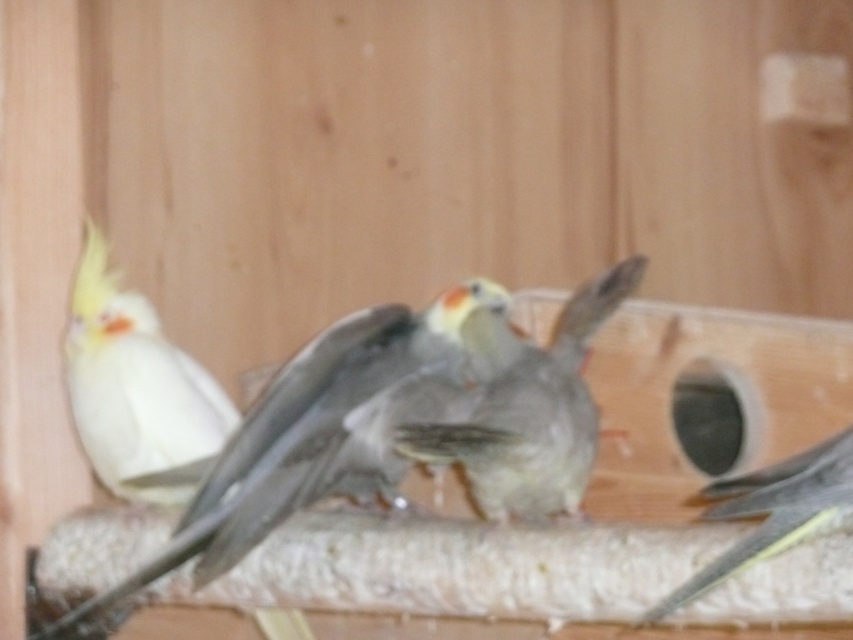
Question: Is white feathered bird at center further to camera compared to gray feathered bird at center?

Choices:
 (A) no
 (B) yes

Answer: (B)

Question: Which object is closer to the camera taking this photo?

Choices:
 (A) gray feathered bird at center
 (B) white feathered parrot at left

Answer: (A)

Question: Can you confirm if white feathered bird at center is positioned above gray feathered bird at center?

Choices:
 (A) no
 (B) yes

Answer: (B)

Question: Is white feathered parrot at left thinner than gray feathered bird at center?

Choices:
 (A) yes
 (B) no

Answer: (B)

Question: Which object is farther from the camera taking this photo?

Choices:
 (A) white feathered bird at center
 (B) gray matte bird at center
 (C) gray feathered bird at center
 (D) white feathered parrot at left

Answer: (D)

Question: Which point appears farthest from the camera in this image?

Choices:
 (A) (660, 618)
 (B) (469, 356)
 (C) (96, 250)

Answer: (C)